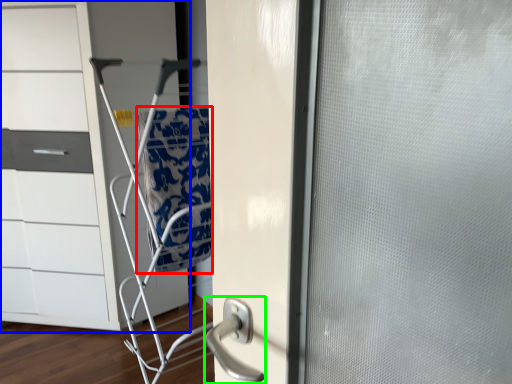
Question: Estimate the real-world distances between objects in this image. Which object is closer to blanket (highlighted by a red box), chest of drawers (highlighted by a blue box) or door handle (highlighted by a green box)?

Choices:
 (A) chest of drawers
 (B) door handle

Answer: (A)